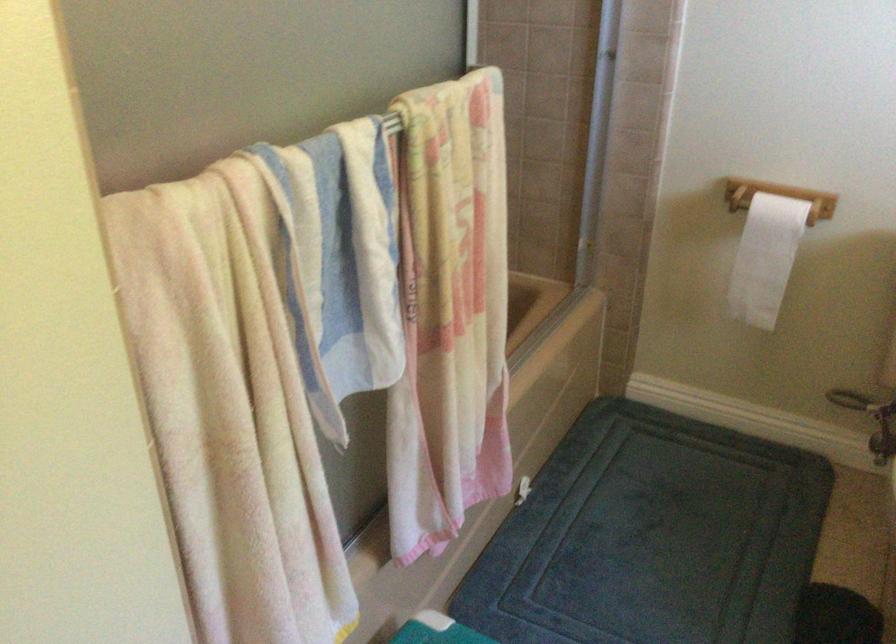
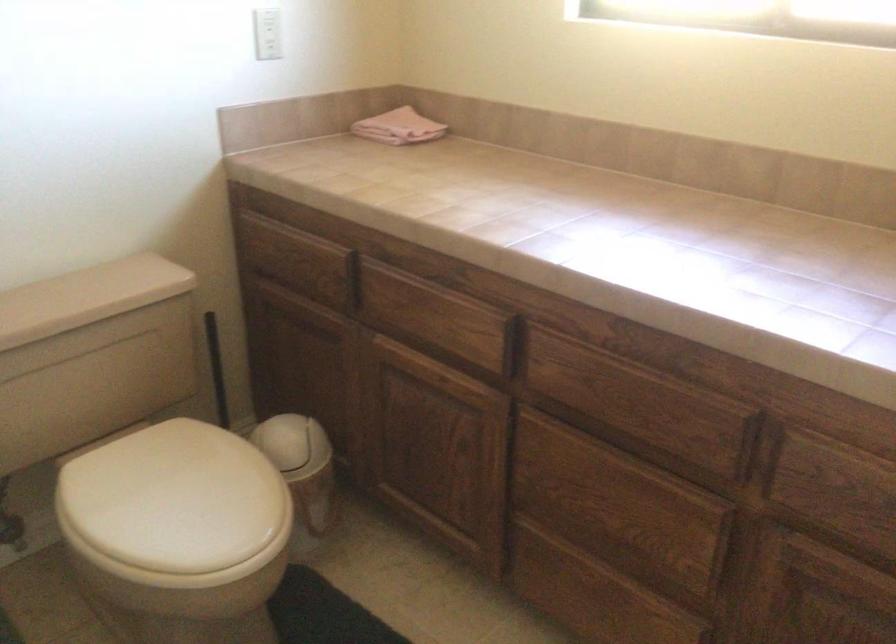
The first image is from the beginning of the video and the second image is from the end. How did the camera likely rotate when shooting the video?

The camera's rotation is toward right-down.